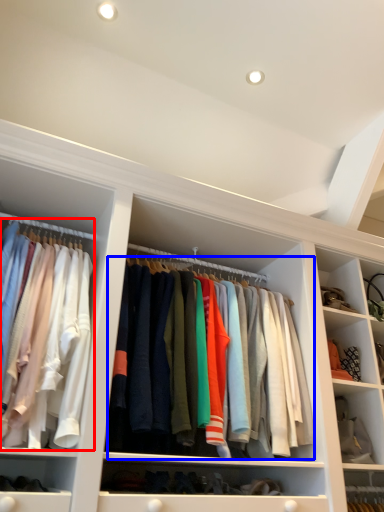
Question: Which object appears closest to the camera in this image, clothing (highlighted by a red box) or clothing (highlighted by a blue box)?

Choices:
 (A) clothing
 (B) clothing

Answer: (A)